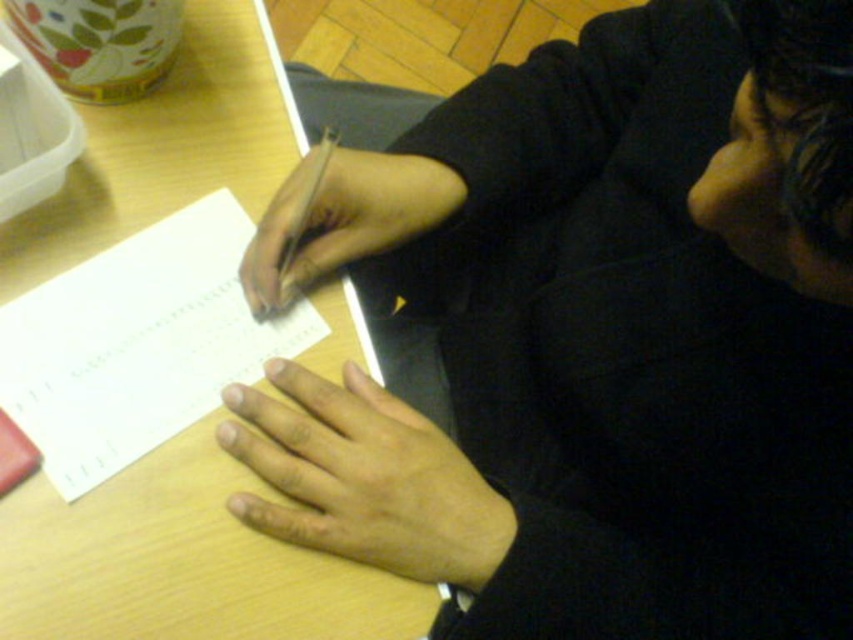
You are a photographer standing at a certain position. You want to capture a closeup shot of the white paper notebook at left without moving the camera. Is the notebook within the focus range of your camera if the minimum focus distance is 20 inches?

The white paper notebook at left is 21.75 inches away from the camera. Since the minimum focus distance is 20 inches, the notebook is within the focus range and can be captured clearly.

You are a painter who needs to place a 6 inch wide canvas between the dark matte hand at center and the wooden table at center. Is there enough space?

The distance between the dark matte hand at center and the wooden table at center is 6.51 inches, so yes, the 6 inch wide canvas can fit between them.

You are a photographer trying to capture the scene from the perspective of the person writing. Which object, the dark matte hand at center or the white paper notepad at lower left, would appear closer to the camera?

The dark matte hand at center is to the right of the white paper notepad at lower left, so from the photographer perspective, the dark matte hand at center would appear closer to the camera.